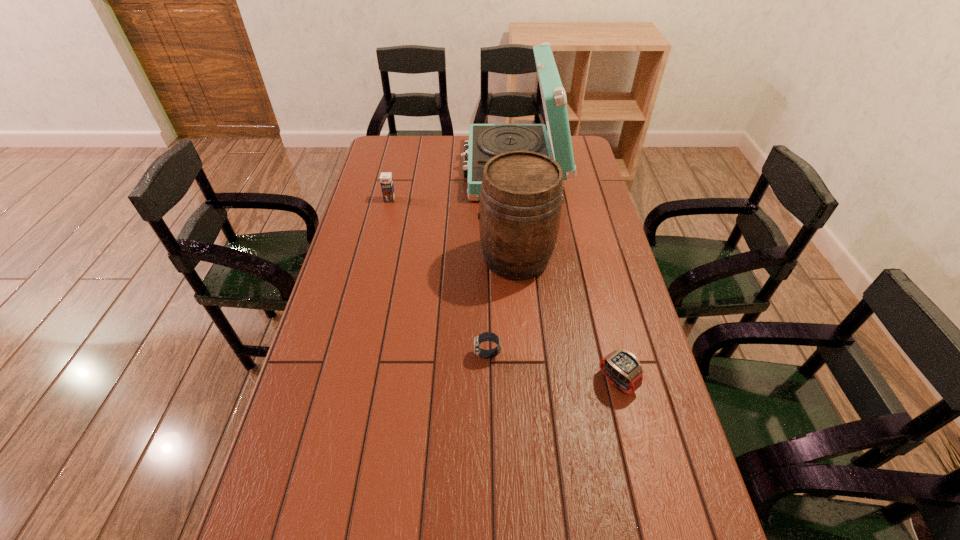
This screenshot has width=960, height=540. In order to click on the tallest object in this screenshot , I will do `click(486, 141)`.

Image resolution: width=960 pixels, height=540 pixels. Identify the location of the third nearest object. (519, 214).

Locate an element on the screen. The height and width of the screenshot is (540, 960). the fourth shortest object is located at coordinates pos(519,214).

This screenshot has width=960, height=540. What are the coordinates of `the leftmost object` in the screenshot? It's located at (386, 181).

What are the coordinates of `the third tallest object` in the screenshot? It's located at (386, 181).

Identify the location of the nearer watch. The image size is (960, 540). (621, 367).

Where is `the right watch`? Image resolution: width=960 pixels, height=540 pixels. the right watch is located at coordinates (621, 367).

Where is `the left watch`? This screenshot has width=960, height=540. the left watch is located at coordinates (486, 336).

Locate an element on the screen. This screenshot has height=540, width=960. the second nearest object is located at coordinates (486, 336).

This screenshot has width=960, height=540. Identify the location of vacant space situated 0.190m on the face side of the tallest object. (416, 170).